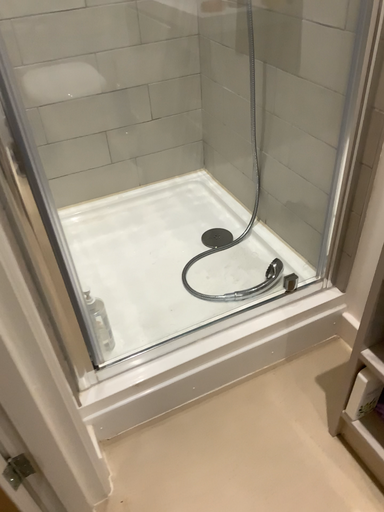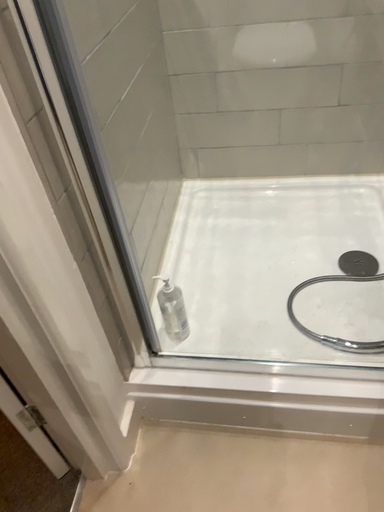
Question: Which way did the camera rotate in the video?

Choices:
 (A) rotated right
 (B) rotated left

Answer: (B)